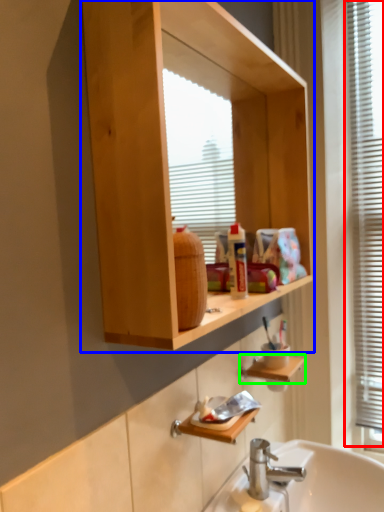
Question: Estimate the real-world distances between objects in this image. Which object is closer to window frame (highlighted by a red box), bathroom cabinet (highlighted by a blue box) or cabinet (highlighted by a green box)?

Choices:
 (A) bathroom cabinet
 (B) cabinet

Answer: (A)